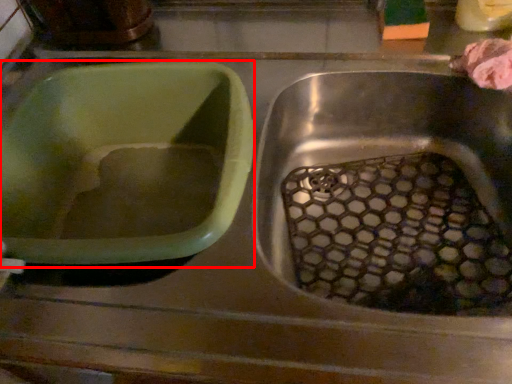
Question: From the image's perspective, what is the correct spatial relationship of basin (annotated by the red box) in relation to food?

Choices:
 (A) above
 (B) below

Answer: (B)